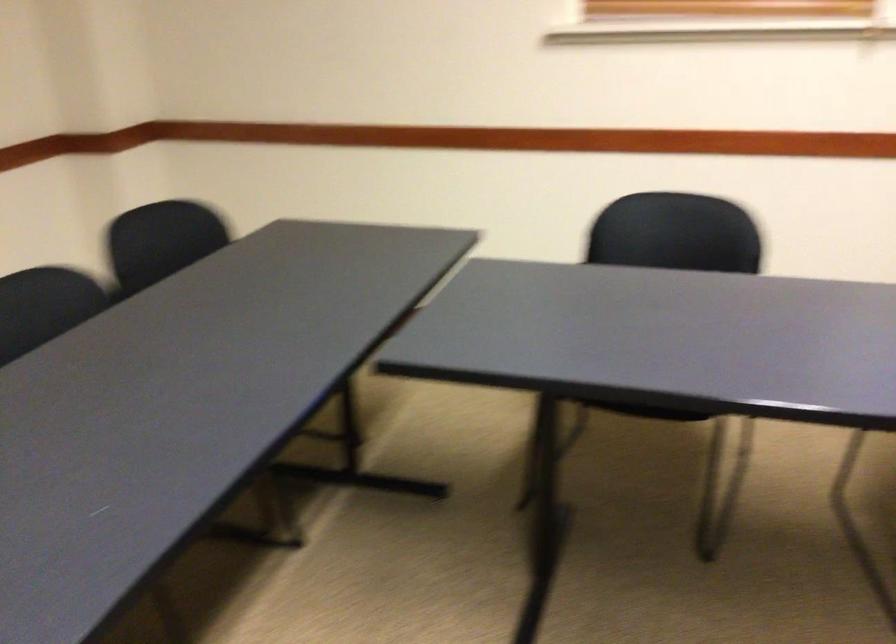
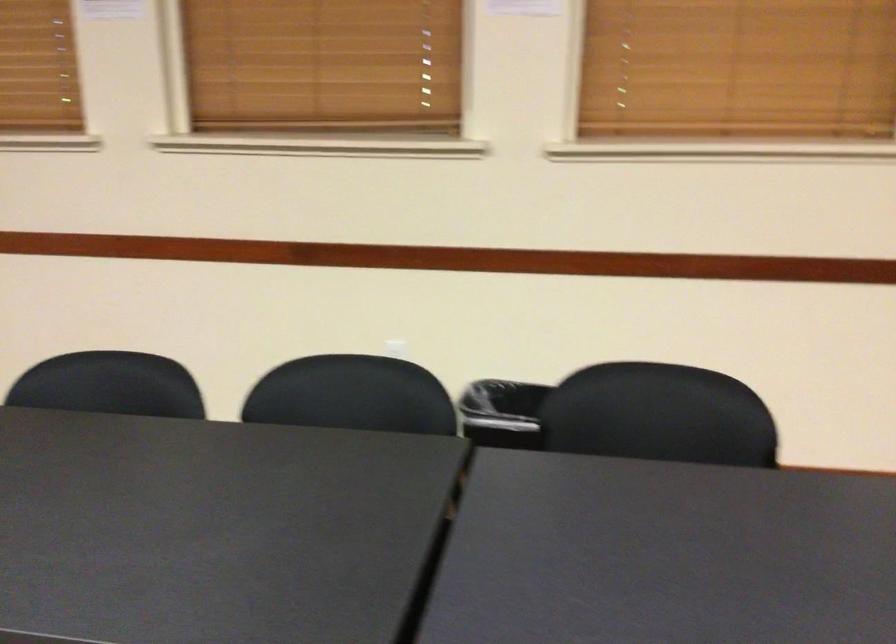
Question: Based on the continuous images, in which direction is the camera rotating? Reply with the corresponding letter.

Choices:
 (A) Left
 (B) Right
 (C) Up
 (D) Down

Answer: (A)